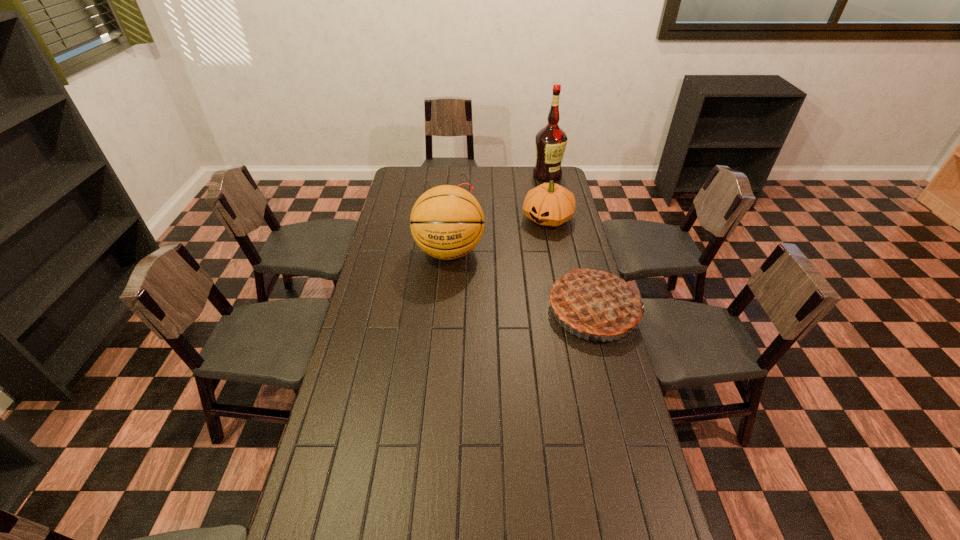
The height and width of the screenshot is (540, 960). I want to click on pie that is at the right edge, so click(595, 302).

Find the location of a particular element. This screenshot has height=540, width=960. alcohol at the right edge is located at coordinates (550, 141).

You are a GUI agent. You are given a task and a screenshot of the screen. Output one action in this format:
    pyautogui.click(x=<x>, y=<y>)
    Task: Click on the gourd that is at the right edge
    This screenshot has height=540, width=960.
    Given the screenshot: What is the action you would take?
    pyautogui.click(x=549, y=204)

Locate an element on the screen. object situated at the far left corner is located at coordinates (462, 174).

Locate an element on the screen. Image resolution: width=960 pixels, height=540 pixels. object located at the far right corner is located at coordinates (550, 141).

Where is `vacant space at the far edge of the desktop`? vacant space at the far edge of the desktop is located at coordinates (468, 175).

Locate an element on the screen. This screenshot has height=540, width=960. vacant space at the near edge of the desktop is located at coordinates (452, 531).

What are the coordinates of `vacant position at the left edge of the desktop` in the screenshot? It's located at (398, 323).

At what (x,y) coordinates should I click in order to perform the action: click on free spot at the right edge of the desktop. Please return your answer as a coordinate pair (x, y). The width and height of the screenshot is (960, 540). Looking at the image, I should click on (607, 373).

This screenshot has width=960, height=540. In the image, there is a desktop. In order to click on blank space at the far left corner in this screenshot , I will do `click(422, 170)`.